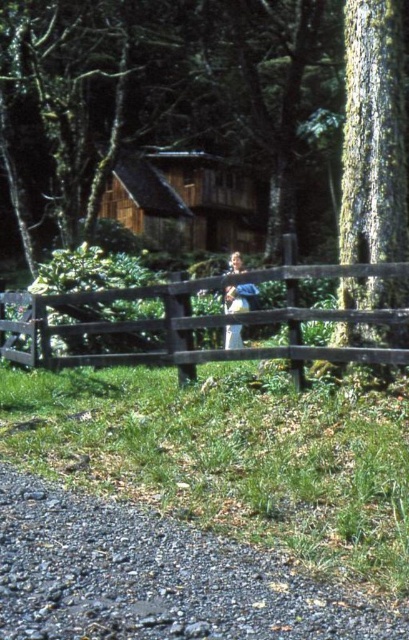
Is smooth bark tree at center right to the right of light blue denim jeans at center from the viewer's perspective?

Yes, smooth bark tree at center right is to the right of light blue denim jeans at center.

Who is more distant from viewer, (404, 289) or (249, 284)?

Positioned behind is point (249, 284).

This screenshot has width=409, height=640. I want to click on smooth bark tree at center right, so click(373, 134).

Measure the distance between gravelly stone path at lower left and camera.

2.26 meters

Which is behind, point (191, 625) or point (368, 129)?

The point (368, 129) is more distant.

At what (x,y) coordinates should I click in order to perform the action: click on gravelly stone path at lower left. Please return your answer as a coordinate pair (x, y). The image size is (409, 640). Looking at the image, I should click on (x=155, y=577).

From the picture: Is gravelly stone path at lower left wider than light blue denim jeans at center?

Yes, gravelly stone path at lower left is wider than light blue denim jeans at center.

Is the position of gravelly stone path at lower left less distant than that of light blue denim jeans at center?

Yes, gravelly stone path at lower left is in front of light blue denim jeans at center.

Identify the location of gravelly stone path at lower left. Image resolution: width=409 pixels, height=640 pixels. 155,577.

This screenshot has width=409, height=640. What are the coordinates of `gravelly stone path at lower left` in the screenshot? It's located at (155, 577).